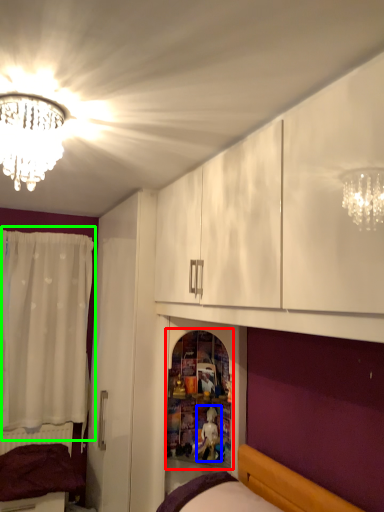
Question: Based on their relative distances, which object is farther from shelf (highlighted by a red box)? Choose from toy (highlighted by a blue box) and curtain (highlighted by a green box).

Choices:
 (A) toy
 (B) curtain

Answer: (B)